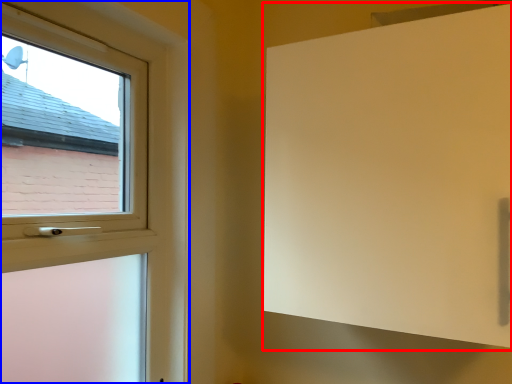
Question: Which object appears closest to the camera in this image, screen door (highlighted by a red box) or window (highlighted by a blue box)?

Choices:
 (A) screen door
 (B) window

Answer: (B)